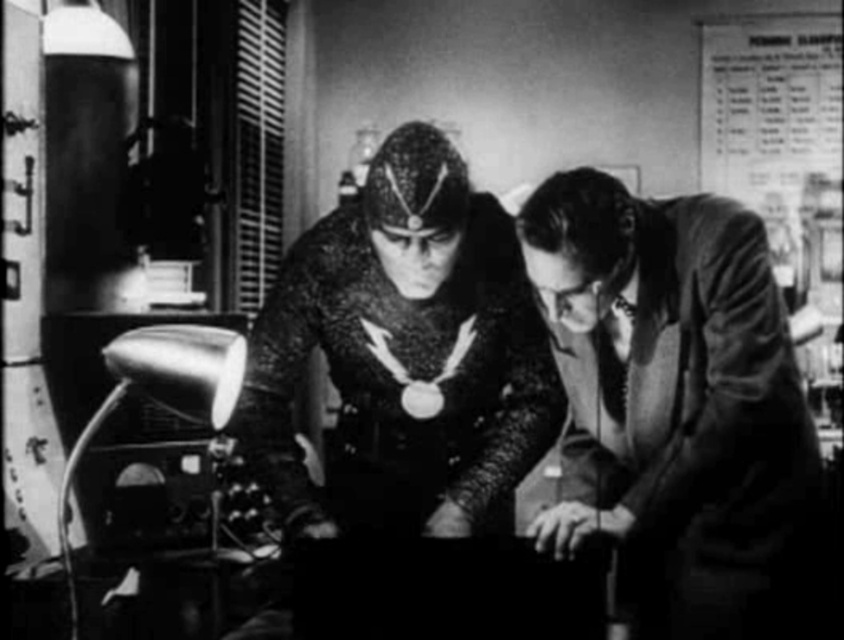
Question: Is metallic chainmail suit at center behind metallic mesh suit at center?

Choices:
 (A) yes
 (B) no

Answer: (B)

Question: Can you confirm if metallic chainmail suit at center is positioned above metallic mesh suit at center?

Choices:
 (A) yes
 (B) no

Answer: (B)

Question: Which point is farther to the camera?

Choices:
 (A) (289, 620)
 (B) (690, 472)

Answer: (A)

Question: Can you confirm if metallic chainmail suit at center is wider than metallic mesh suit at center?

Choices:
 (A) no
 (B) yes

Answer: (A)

Question: Which of the following is the closest to the observer?

Choices:
 (A) metallic chainmail suit at center
 (B) metallic mesh suit at center

Answer: (A)